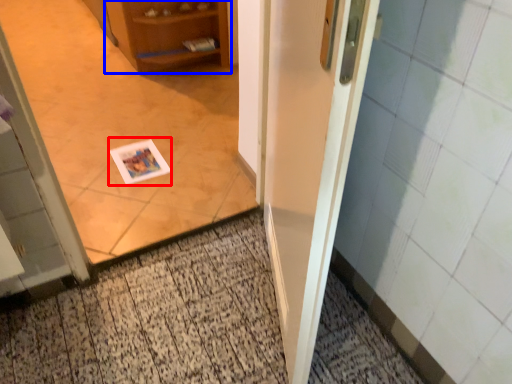
Question: Which of the following is the closest to the observer, postcard (highlighted by a red box) or cabinetry (highlighted by a blue box)?

Choices:
 (A) postcard
 (B) cabinetry

Answer: (A)